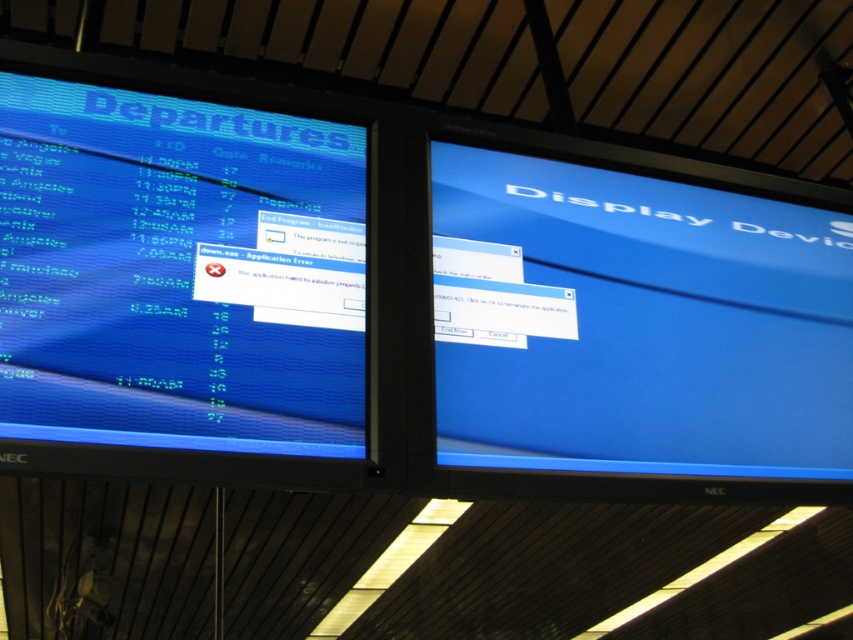
You are standing in front of two monitors, the matte blue display at left and the blue glossy monitor at center. Which monitor is nearer to you?

The matte blue display at left is closer to the viewer than the blue glossy monitor at center.

You are a traveler trying to find the departure gate for your flight. You see two monitors, a matte blue display at left and a blue glossy monitor at center. Which monitor should you look at to find departure information?

The matte blue display at left shows departure information, so you should look at the matte blue display at left.